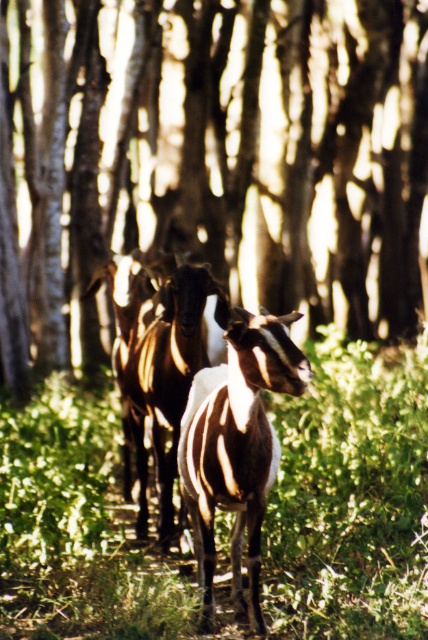
You are a photographer trying to capture the two goats in the forest scene. You notice the green leafy grass at center and the brown textured goat at center. Which object is located to the right of the other?

The green leafy grass at center is positioned on the right side of brown textured goat at center.

You are a hiker trying to navigate through this forest scene. You notice the brown wood tree at center and the green leafy grass at center. Which of these two objects would block your path more if you were to walk straight ahead?

The brown wood tree at center is bigger than the green leafy grass at center, so it would block your path more if you were to walk straight ahead.